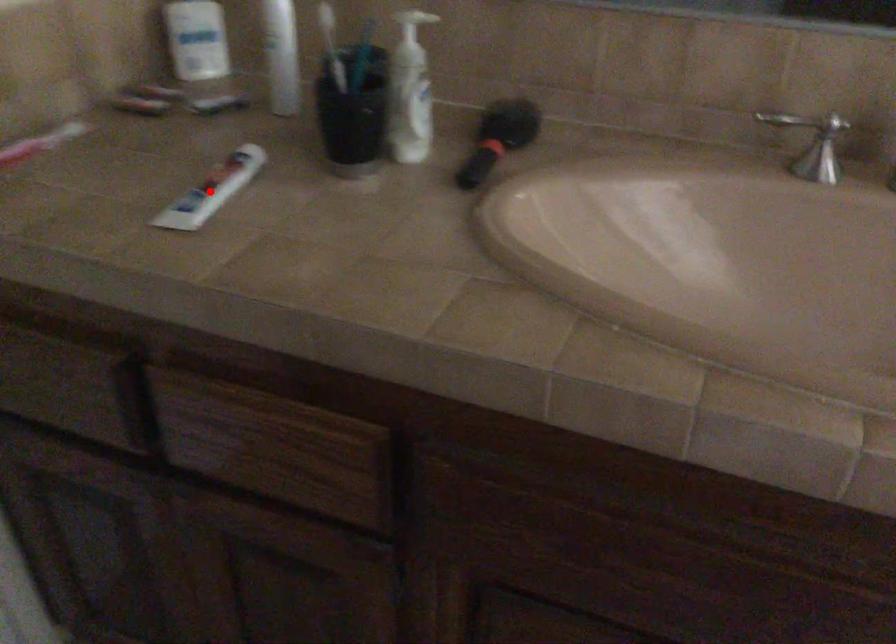
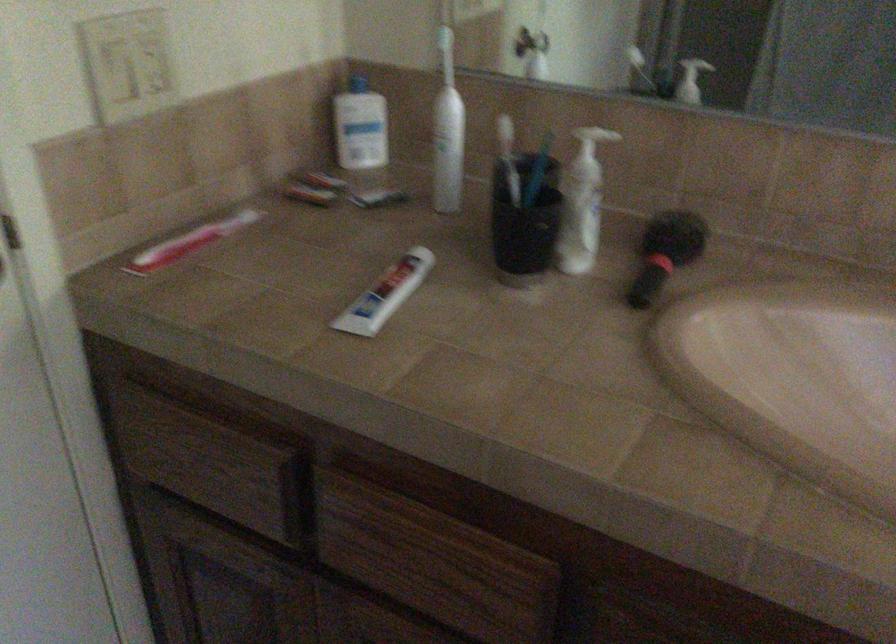
Where in the second image is the point corresponding to the highlighted location from the first image?

(385, 294)